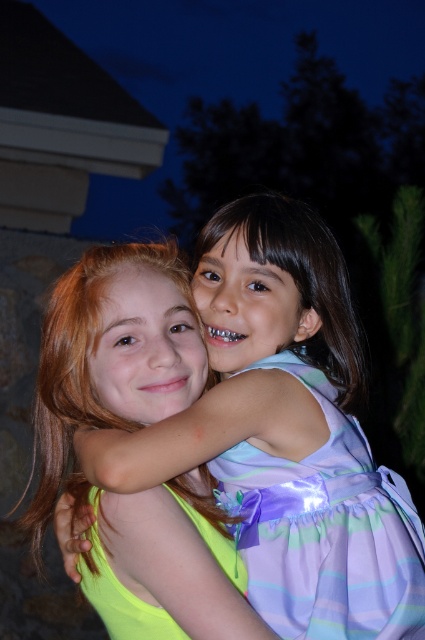
Between point (189, 465) and point (93, 486), which one is positioned behind?

Point (93, 486)

Looking at this image, is neon green dress at center to the right of neon green satin dress at center from the viewer's perspective?

Indeed, neon green dress at center is positioned on the right side of neon green satin dress at center.

The height and width of the screenshot is (640, 425). What are the coordinates of `neon green dress at center` in the screenshot? It's located at [x=286, y=433].

Who is more forward, (x=410, y=502) or (x=413, y=602)?

Point (x=413, y=602) is in front.

Does neon green dress at center have a smaller size compared to purple satin dress at center?

No.

The height and width of the screenshot is (640, 425). Identify the location of neon green dress at center. (286, 433).

Which is behind, point (329, 596) or point (91, 532)?

The point (91, 532) is behind.

Does purple satin dress at center have a smaller size compared to neon green satin dress at center?

Incorrect, purple satin dress at center is not smaller in size than neon green satin dress at center.

Between point (308, 596) and point (96, 541), which one is positioned behind?

The point (308, 596) is behind.

Find the location of a particular element. purple satin dress at center is located at coordinates (325, 531).